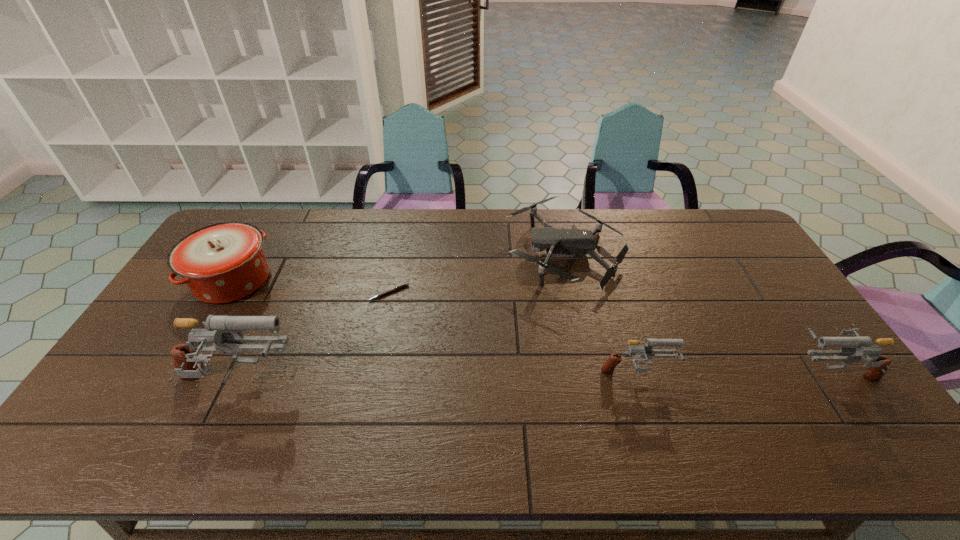
The image size is (960, 540). I want to click on the third closest object to the second gun from right to left, so click(406, 284).

Identify which object is located as the third nearest to the shortest object. Please provide its 2D coordinates. Your answer should be formatted as a tuple, i.e. [(x, y)], where the tuple contains the x and y coordinates of a point satisfying the conditions above.

[(225, 262)]

The width and height of the screenshot is (960, 540). I want to click on the second closest gun to the casserole, so click(608, 367).

Find the location of `the closest gun to the casserole`. the closest gun to the casserole is located at coordinates (188, 365).

Locate an element on the screen. This screenshot has width=960, height=540. vacant space that satisfies the following two spatial constraints: 1. at the nib of the shortest object; 2. at the barrel end of the leftmost gun is located at coordinates point(370,383).